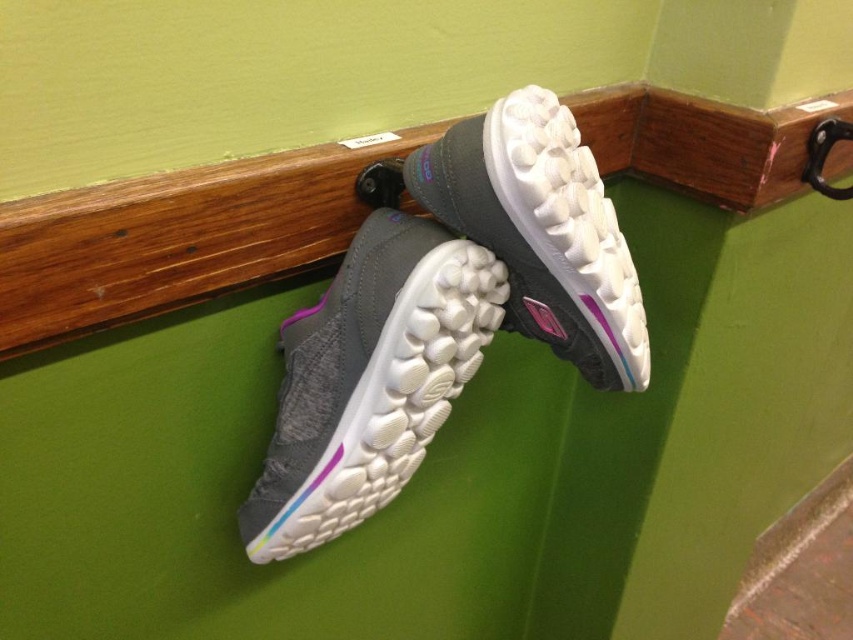
Question: Considering the real-world distances, which object is closest to the gray fabric shoe at center?

Choices:
 (A) gray rubber shoe at center
 (B) wooden ledge at upper center

Answer: (A)

Question: Which point is farther to the camera?

Choices:
 (A) (514, 154)
 (B) (178, 266)

Answer: (B)

Question: Can you confirm if gray fabric shoe at center is smaller than gray rubber shoe at center?

Choices:
 (A) yes
 (B) no

Answer: (A)

Question: Is gray fabric shoe at center closer to camera compared to gray rubber shoe at center?

Choices:
 (A) yes
 (B) no

Answer: (B)

Question: Which of the following is the closest to the observer?

Choices:
 (A) wooden ledge at upper center
 (B) gray fabric shoe at center

Answer: (B)

Question: Can you confirm if wooden ledge at upper center is thinner than gray fabric shoe at center?

Choices:
 (A) yes
 (B) no

Answer: (B)